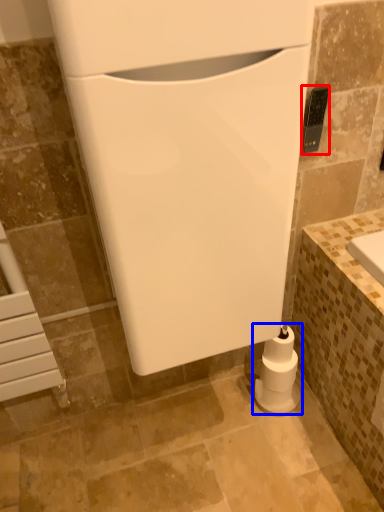
Question: Which point is closer to the camera, appliance (highlighted by a red box) or toilet paper (highlighted by a blue box)?

Choices:
 (A) appliance
 (B) toilet paper

Answer: (A)